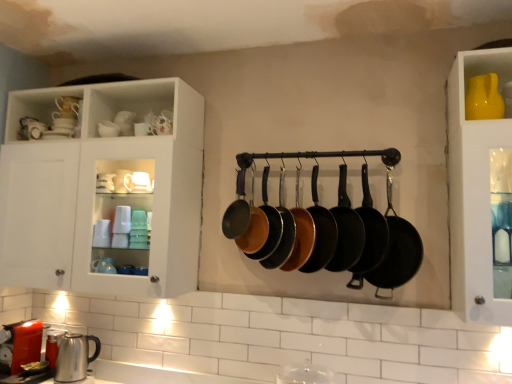
Question: Is white glossy cabinet at upper left smaller than matte black frying pan at center, placed as the 3th frying pan when sorted from left to right?

Choices:
 (A) yes
 (B) no

Answer: (B)

Question: Would you say white glossy cabinet at upper left contains matte black frying pan at center, which is the sixth frying pan from right to left?

Choices:
 (A) yes
 (B) no

Answer: (B)

Question: Considering the relative positions of white glossy cabinet at upper left and matte black frying pan at center, placed as the 3th frying pan when sorted from left to right, in the image provided, is white glossy cabinet at upper left to the right of matte black frying pan at center, placed as the 3th frying pan when sorted from left to right, from the viewer's perspective?

Choices:
 (A) no
 (B) yes

Answer: (A)

Question: Is white glossy cabinet at upper left not within matte black frying pan at center, which is the sixth frying pan from right to left?

Choices:
 (A) yes
 (B) no

Answer: (A)

Question: Is white glossy cabinet at upper left closer to camera compared to matte black frying pan at center, which is the sixth frying pan from right to left?

Choices:
 (A) no
 (B) yes

Answer: (A)

Question: Is white glossy cabinet at upper left aimed at matte black frying pan at center, which is the sixth frying pan from right to left?

Choices:
 (A) no
 (B) yes

Answer: (A)

Question: Considering the relative positions of matte black frying pan at center, the fifth frying pan in the left-to-right sequence, and black cast iron frying pan at center, which is counted as the 1th frying pan, starting from the right, in the image provided, is matte black frying pan at center, the fifth frying pan in the left-to-right sequence, to the right of black cast iron frying pan at center, which is counted as the 1th frying pan, starting from the right, from the viewer's perspective?

Choices:
 (A) yes
 (B) no

Answer: (B)

Question: From the image's perspective, is matte black frying pan at center, acting as the 4th frying pan starting from the right, below black cast iron frying pan at center, which is counted as the 1th frying pan, starting from the right?

Choices:
 (A) yes
 (B) no

Answer: (B)

Question: Can you confirm if matte black frying pan at center, the fifth frying pan in the left-to-right sequence, is thinner than black cast iron frying pan at center, which is counted as the 1th frying pan, starting from the right?

Choices:
 (A) no
 (B) yes

Answer: (A)

Question: Would you say matte black frying pan at center, the fifth frying pan in the left-to-right sequence, is outside black cast iron frying pan at center, which is counted as the 1th frying pan, starting from the right?

Choices:
 (A) no
 (B) yes

Answer: (B)

Question: Is matte black frying pan at center, the fifth frying pan in the left-to-right sequence, further to the viewer compared to black cast iron frying pan at center, which is the 8th frying pan in left-to-right order?

Choices:
 (A) no
 (B) yes

Answer: (B)

Question: Considering the relative sizes of matte black frying pan at center, acting as the 4th frying pan starting from the right, and black cast iron frying pan at center, which is the 8th frying pan in left-to-right order, in the image provided, is matte black frying pan at center, acting as the 4th frying pan starting from the right, wider than black cast iron frying pan at center, which is the 8th frying pan in left-to-right order,?

Choices:
 (A) yes
 (B) no

Answer: (A)

Question: Considering the relative sizes of black cast iron frying pan at center, which is the 8th frying pan in left-to-right order, and matte black frying pan at center, placed as the 3th frying pan when sorted from left to right, in the image provided, is black cast iron frying pan at center, which is the 8th frying pan in left-to-right order, bigger than matte black frying pan at center, placed as the 3th frying pan when sorted from left to right,?

Choices:
 (A) yes
 (B) no

Answer: (A)